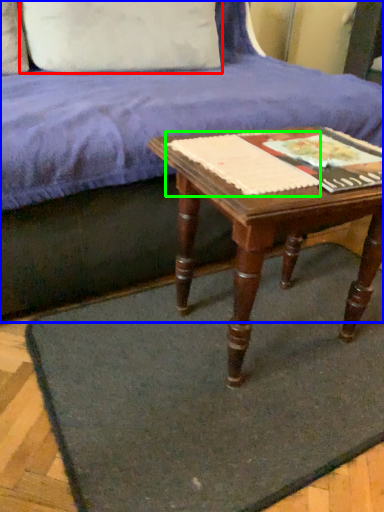
Question: Considering the real-world distances, which object is farthest from pillow (highlighted by a red box)? studio couch (highlighted by a blue box) or paperback book (highlighted by a green box)?

Choices:
 (A) studio couch
 (B) paperback book

Answer: (B)